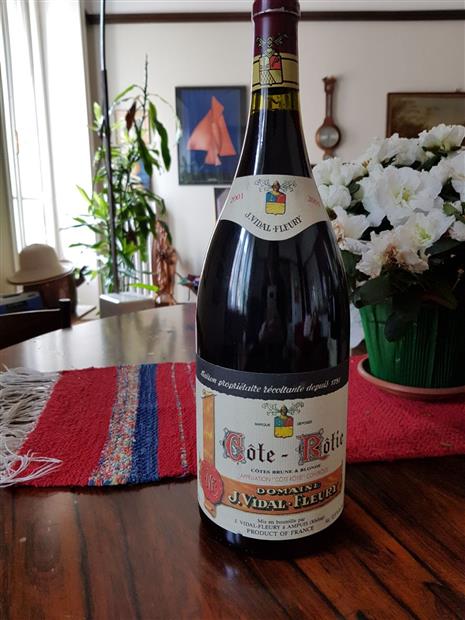
I want to click on circular wall clock, so click(x=331, y=139).